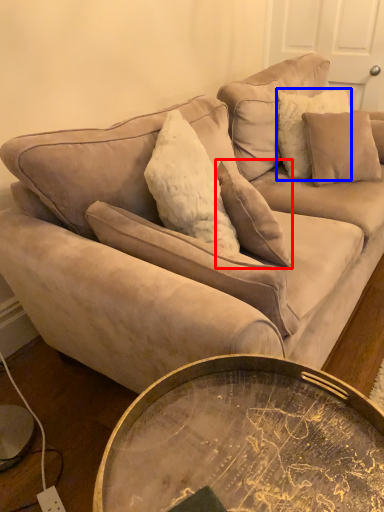
Question: Among these objects, which one is farthest to the camera, pillow (highlighted by a red box) or pillow (highlighted by a blue box)?

Choices:
 (A) pillow
 (B) pillow

Answer: (B)